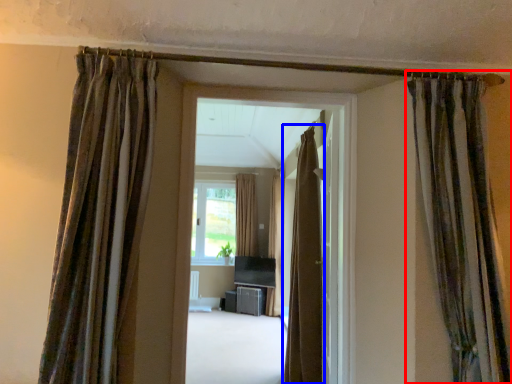
Question: Which object is closer to the camera taking this photo, curtain (highlighted by a red box) or curtain (highlighted by a blue box)?

Choices:
 (A) curtain
 (B) curtain

Answer: (A)